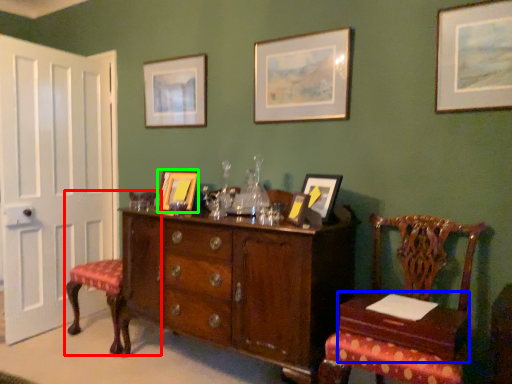
Question: Which is farther away from chair (highlighted by a red box)? table (highlighted by a blue box) or picture frame (highlighted by a green box)?

Choices:
 (A) table
 (B) picture frame

Answer: (A)